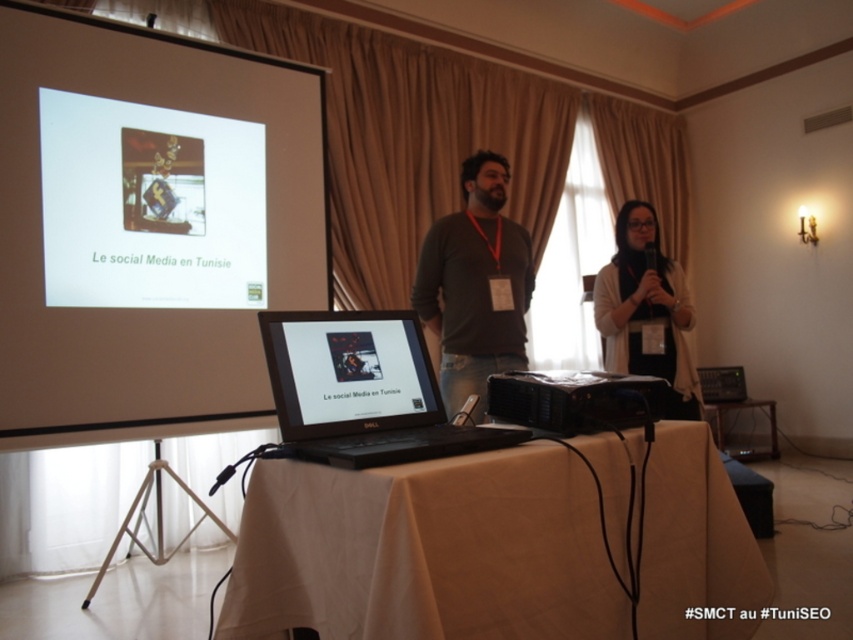
Can you confirm if white fabric jacket at center is taller than black plastic projector at center?

Yes.

Who is more distant from viewer, (641, 296) or (579, 394)?

The point (641, 296) is more distant.

This screenshot has width=853, height=640. What do you see at coordinates (646, 310) in the screenshot? I see `white fabric jacket at center` at bounding box center [646, 310].

The image size is (853, 640). What are the coordinates of `white fabric jacket at center` in the screenshot? It's located at (646, 310).

Which is behind, point (300, 438) or point (654, 328)?

Positioned behind is point (654, 328).

Can you confirm if black matte laptop at center is positioned to the right of white fabric jacket at center?

Incorrect, black matte laptop at center is not on the right side of white fabric jacket at center.

Between point (363, 433) and point (650, 333), which one is positioned behind?

Point (650, 333)

Where is `black matte laptop at center`? black matte laptop at center is located at coordinates (x=363, y=390).

Identify the location of matte black laptop at center. Image resolution: width=853 pixels, height=640 pixels. (351, 369).

Does matte black laptop at center have a lesser height compared to black leather speaker at lower right?

Yes.

Between point (355, 346) and point (757, 512), which one is positioned in front?

Point (355, 346) is in front.

The width and height of the screenshot is (853, 640). In order to click on matte black laptop at center in this screenshot , I will do `click(351, 369)`.